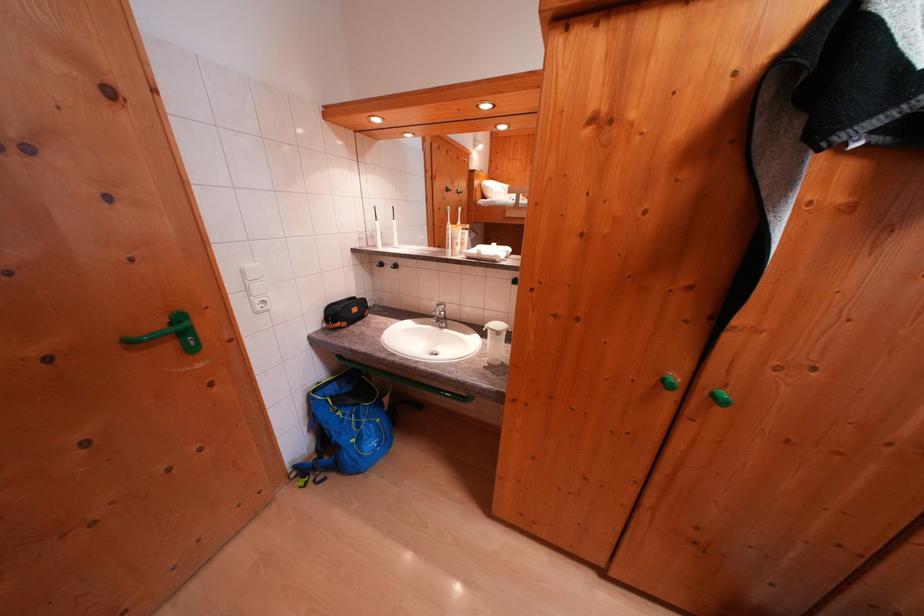
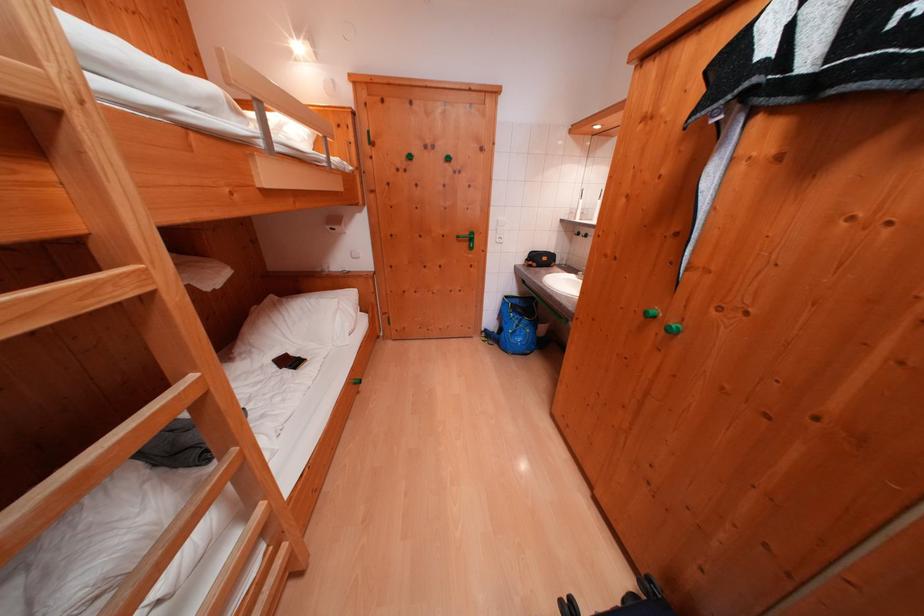
The point at (322, 395) is marked in the first image. Where is the corresponding point in the second image?

(515, 301)